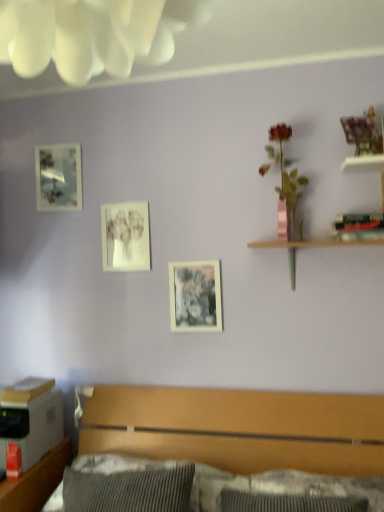
Question: Is black matte picture frame at center, which appears as the third picture frame when viewed from the back, not close to brushed wood dresser at lower left?

Choices:
 (A) no
 (B) yes

Answer: (A)

Question: From a real-world perspective, is black matte picture frame at center, the 3th picture frame in the top-to-bottom sequence, physically below brushed wood dresser at lower left?

Choices:
 (A) yes
 (B) no

Answer: (B)

Question: Can you confirm if black matte picture frame at center, which appears as the third picture frame when viewed from the back, is shorter than brushed wood dresser at lower left?

Choices:
 (A) no
 (B) yes

Answer: (B)

Question: Does black matte picture frame at center, which appears as the third picture frame when viewed from the back, have a greater height compared to brushed wood dresser at lower left?

Choices:
 (A) yes
 (B) no

Answer: (B)

Question: Is black matte picture frame at center, which is counted as the first picture frame, starting from the bottom, in contact with brushed wood dresser at lower left?

Choices:
 (A) no
 (B) yes

Answer: (A)

Question: Is matte black picture frame at upper left, placed as the 1th picture frame when sorted from top to bottom, wider or thinner than matte paper picture frame at center, which ranks as the 2th picture frame in right-to-left order?

Choices:
 (A) wide
 (B) thin

Answer: (A)

Question: Considering the positions of matte black picture frame at upper left, marked as the first picture frame in a left-to-right arrangement, and matte paper picture frame at center, which ranks as the 2th picture frame in right-to-left order, in the image, is matte black picture frame at upper left, marked as the first picture frame in a left-to-right arrangement, taller or shorter than matte paper picture frame at center, which ranks as the 2th picture frame in right-to-left order,?

Choices:
 (A) tall
 (B) short

Answer: (B)

Question: From a real-world perspective, is matte black picture frame at upper left, marked as the first picture frame in a left-to-right arrangement, physically located above or below matte paper picture frame at center, the second picture frame positioned from the back?

Choices:
 (A) below
 (B) above

Answer: (B)

Question: Relative to matte paper picture frame at center, which is counted as the 2th picture frame, starting from the bottom, is matte black picture frame at upper left, which ranks as the 1th picture frame in back-to-front order, in front or behind?

Choices:
 (A) front
 (B) behind

Answer: (B)

Question: From a real-world perspective, is matte paper picture frame at center, the second picture frame positioned from the back, above or below wooden bed at lower center?

Choices:
 (A) below
 (B) above

Answer: (B)

Question: In the image, is matte paper picture frame at center, which is counted as the 2th picture frame, starting from the bottom, on the left side or the right side of wooden bed at lower center?

Choices:
 (A) left
 (B) right

Answer: (A)

Question: Choose the correct answer: Is matte paper picture frame at center, which ranks as the 2th picture frame in right-to-left order, inside wooden bed at lower center or outside it?

Choices:
 (A) inside
 (B) outside

Answer: (B)

Question: Does point (110, 233) appear closer or farther from the camera than point (205, 391)?

Choices:
 (A) farther
 (B) closer

Answer: (A)

Question: Looking at the image, does matte paper picture frame at center, which is the 2th picture frame from left to right, seem bigger or smaller compared to pink metallic vase at upper right?

Choices:
 (A) big
 (B) small

Answer: (B)

Question: In terms of height, does matte paper picture frame at center, which is the 2th picture frame from left to right, look taller or shorter compared to pink metallic vase at upper right?

Choices:
 (A) tall
 (B) short

Answer: (B)